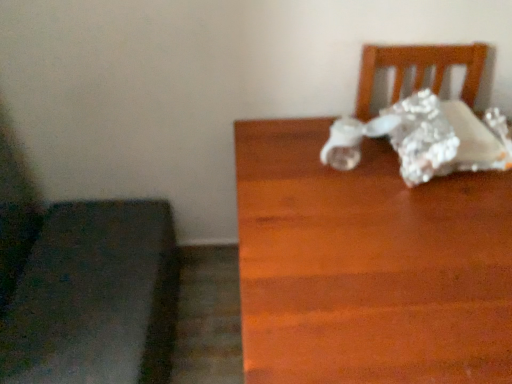
The height and width of the screenshot is (384, 512). Identify the location of blank space situated above wooden table at right (from a real-world perspective). (380, 220).